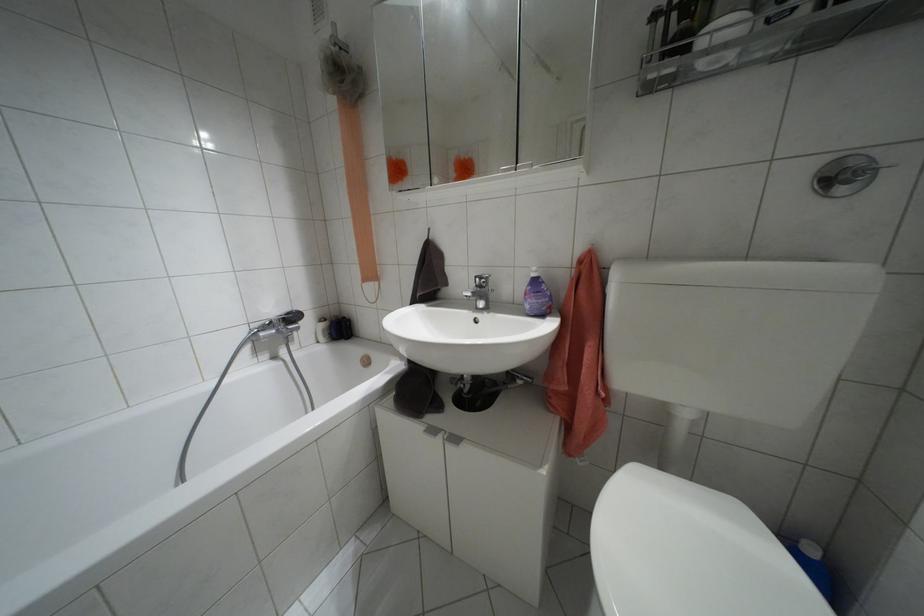
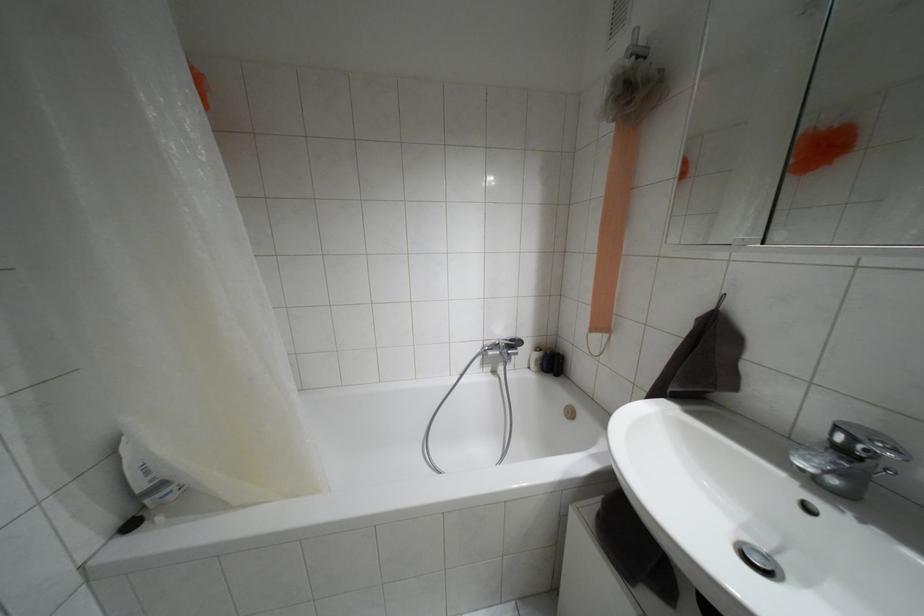
Question: The camera is either moving clockwise (left) or counter-clockwise (right) around the object. The first image is from the beginning of the video and the second image is from the end. Is the camera moving left or right when shooting the video?

Choices:
 (A) Left
 (B) Right

Answer: (B)